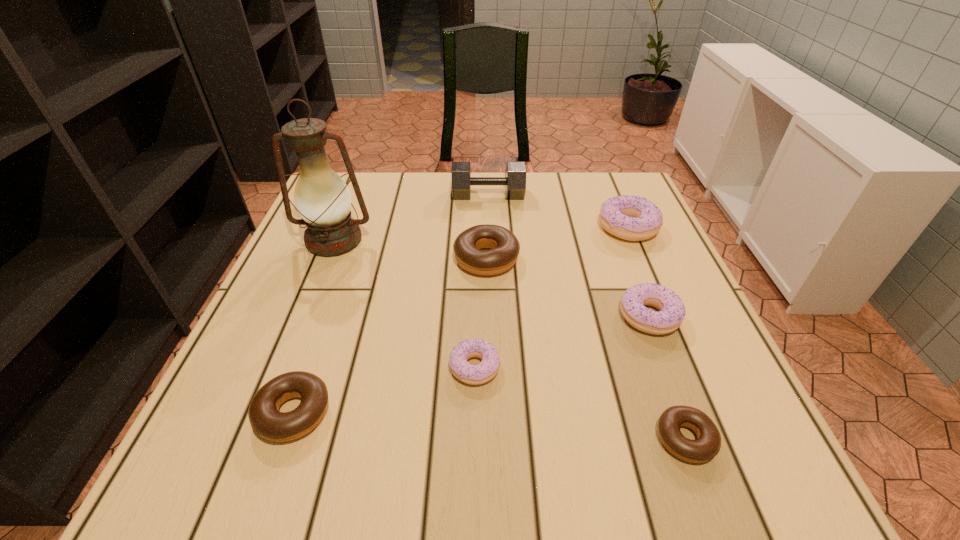
This screenshot has height=540, width=960. What are the coordinates of `free area in between the second biggest purple doughnut and the oil lamp` in the screenshot? It's located at (492, 279).

The image size is (960, 540). Find the location of `empty space between the smallest purple doughnut and the fourth nearest object`. empty space between the smallest purple doughnut and the fourth nearest object is located at coordinates (562, 342).

Find the location of a particular element. The image size is (960, 540). object that stands as the closest to the second smallest brown doughnut is located at coordinates (478, 374).

Where is `object identified as the fifth closest to the biggest purple doughnut`? object identified as the fifth closest to the biggest purple doughnut is located at coordinates (707, 445).

Identify which doughnut is located as the fifth nearest to the second smallest purple doughnut. Please provide its 2D coordinates. Your answer should be formatted as a tuple, i.e. [(x, y)], where the tuple contains the x and y coordinates of a point satisfying the conditions above.

[(265, 419)]

Locate an element on the screen. This screenshot has width=960, height=540. the closest doughnut to the second nearest purple doughnut is located at coordinates (707, 445).

Locate an element on the screen. This screenshot has width=960, height=540. purple doughnut that is the third closest to the rightmost brown doughnut is located at coordinates (633, 218).

Where is `purple doughnut that is the second nearest to the farthest purple doughnut`? The height and width of the screenshot is (540, 960). purple doughnut that is the second nearest to the farthest purple doughnut is located at coordinates (478, 374).

Identify which brown doughnut is located as the nearest to the biggest purple doughnut. Please provide its 2D coordinates. Your answer should be formatted as a tuple, i.e. [(x, y)], where the tuple contains the x and y coordinates of a point satisfying the conditions above.

[(505, 247)]

Identify the location of brown doughnut object that ranks as the third closest to the biggest purple doughnut. (265, 419).